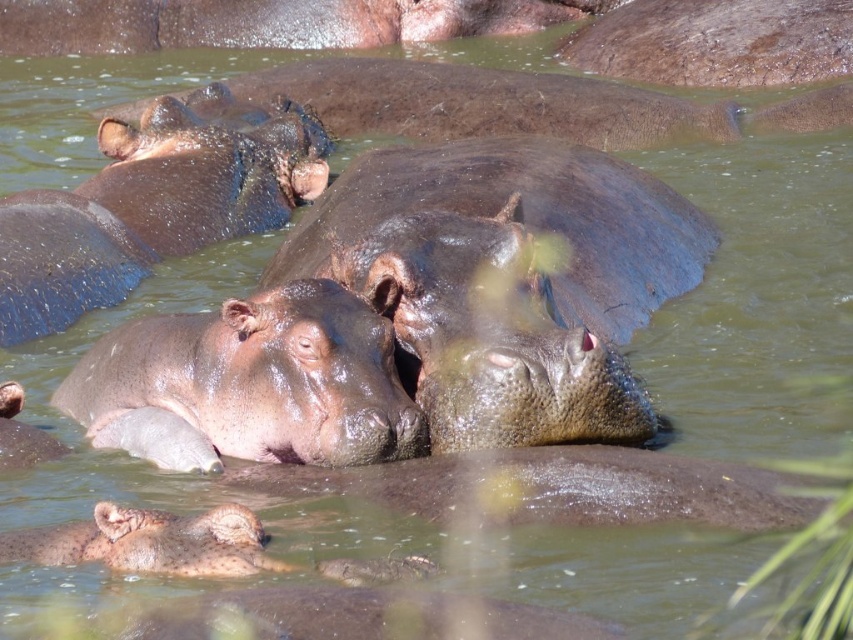
Question: Is slick brown hippo at upper center to the right of slick gray hippo at center from the viewer's perspective?

Choices:
 (A) yes
 (B) no

Answer: (B)

Question: Which point is closer to the camera?

Choices:
 (A) slick brown hippo at center
 (B) smooth brown hippo at upper center
 (C) slick brown hippo at upper center

Answer: (A)

Question: Estimate the real-world distances between objects in this image. Which object is closer to the slick gray hippo at center?

Choices:
 (A) pinkish matte hippo at center
 (B) slick brown hippo at center

Answer: (A)

Question: Does slick brown hippo at center lie behind smooth brown hippo at upper center?

Choices:
 (A) no
 (B) yes

Answer: (A)

Question: Considering the relative positions of pinkish matte hippo at center and smooth gray hippo at lower center in the image provided, where is pinkish matte hippo at center located with respect to smooth gray hippo at lower center?

Choices:
 (A) left
 (B) right

Answer: (A)

Question: Which point is closer to the camera?

Choices:
 (A) (490, 19)
 (B) (427, 499)
 (C) (267, 358)
 (D) (519, 211)

Answer: (B)